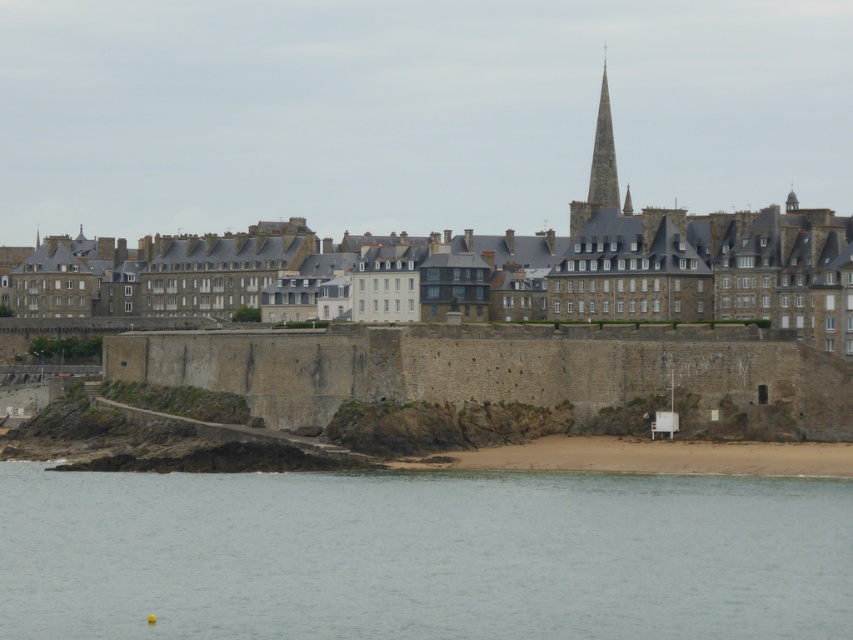
Is stone wall at center further to the viewer compared to smooth stone spire at center?

No.

Does stone wall at center have a greater height compared to smooth stone spire at center?

Correct, stone wall at center is much taller as smooth stone spire at center.

Who is more forward, (706,260) or (599,145)?

Point (706,260) is in front.

Where is `stone wall at center`? The width and height of the screenshot is (853, 640). stone wall at center is located at coordinates (676, 268).

Does clear water at lower center have a lesser height compared to smooth stone spire at center?

Indeed, clear water at lower center has a lesser height compared to smooth stone spire at center.

The width and height of the screenshot is (853, 640). What do you see at coordinates (421, 554) in the screenshot? I see `clear water at lower center` at bounding box center [421, 554].

In order to click on clear water at lower center in this screenshot , I will do `click(421, 554)`.

Does clear water at lower center appear on the left side of stone wall at center?

Yes, clear water at lower center is to the left of stone wall at center.

Identify the location of clear water at lower center. (421, 554).

Which is in front, point (180, 531) or point (495, 275)?

Point (180, 531) is in front.

Identify the location of clear water at lower center. (421, 554).